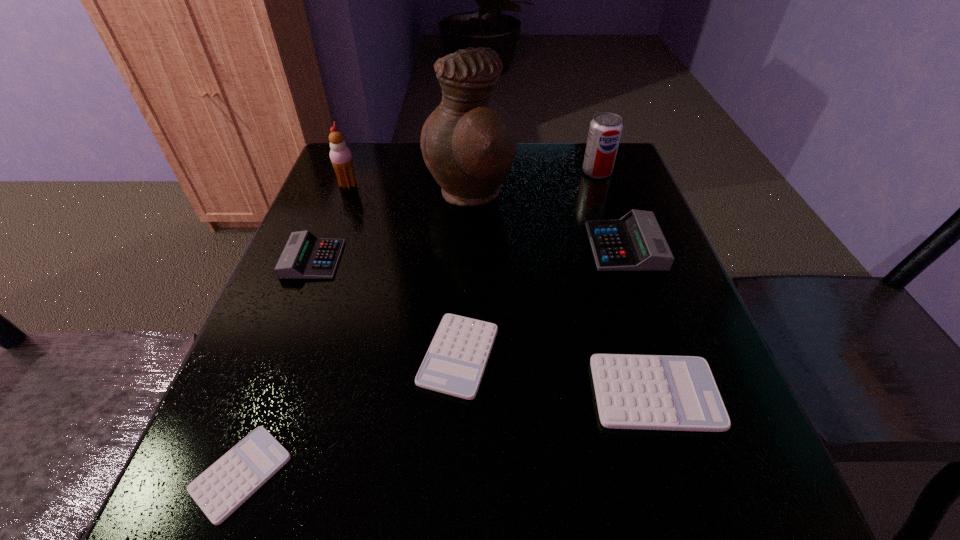
Where is `pitcher`? The width and height of the screenshot is (960, 540). pitcher is located at coordinates (469, 142).

Identify the location of brown pitcher. pyautogui.click(x=469, y=142).

Image resolution: width=960 pixels, height=540 pixels. Find the location of `icecream`. icecream is located at coordinates (340, 155).

Locate an element on the screen. soda is located at coordinates (605, 130).

The width and height of the screenshot is (960, 540). What are the coordinates of `the tallest calculator` in the screenshot? It's located at (635, 242).

Where is `the right gray calculator`? The image size is (960, 540). the right gray calculator is located at coordinates (635, 242).

The image size is (960, 540). Find the location of `the fourth shortest object`. the fourth shortest object is located at coordinates (305, 256).

Find the location of a particular element. This screenshot has height=540, width=960. the left gray calculator is located at coordinates (305, 256).

In order to click on the third shortest object in this screenshot , I will do `click(650, 392)`.

Image resolution: width=960 pixels, height=540 pixels. I want to click on the third shortest calculator, so click(650, 392).